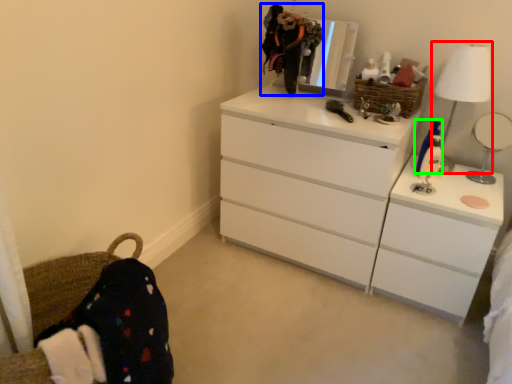
Question: Which object is the closest to the table lamp (highlighted by a red box)? Choose among these: selfie (highlighted by a blue box) or toy (highlighted by a green box).

Choices:
 (A) selfie
 (B) toy

Answer: (B)